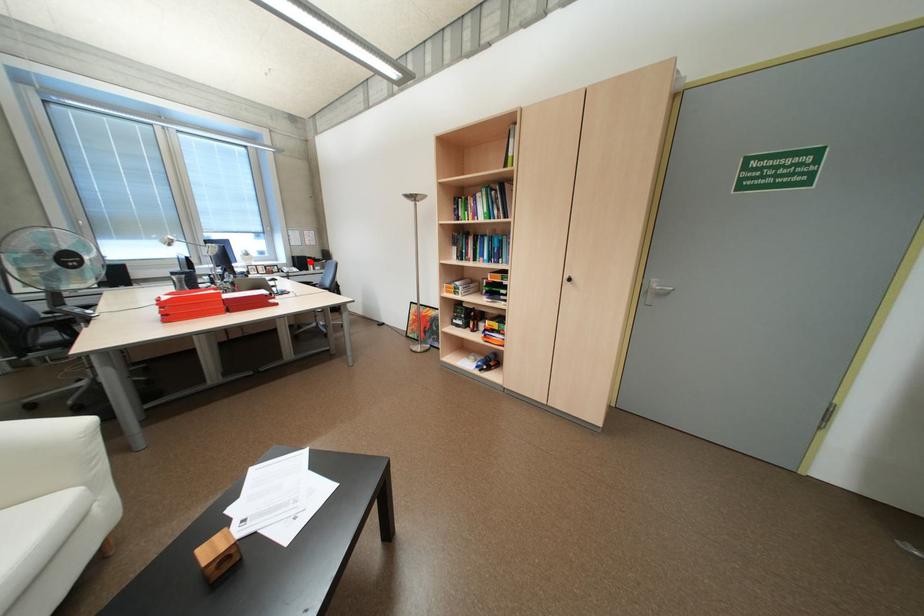
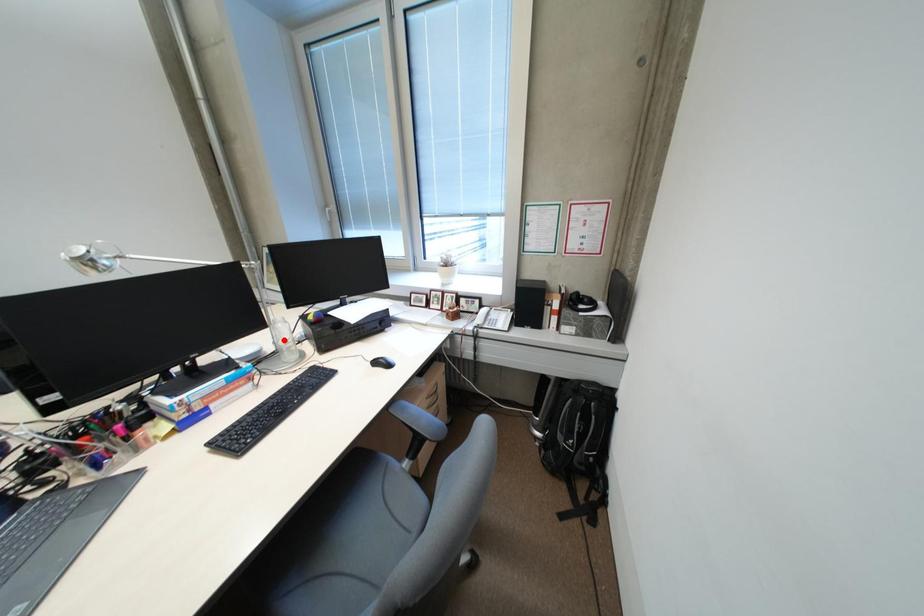
I am providing you with two images of the same scene from different viewpoints. A red point is marked on the first image and another point is marked on the second image. Do the highlighted points in image1 and image2 indicate the same real-world spot?

No